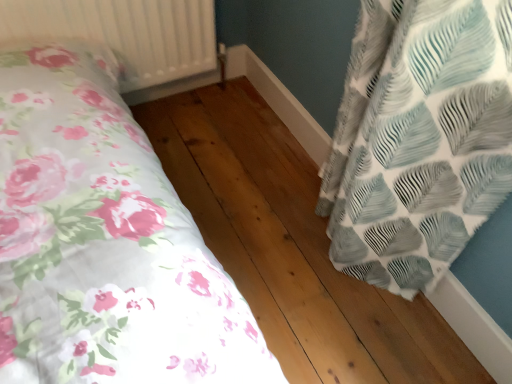
Question: Considering the relative sizes of natural wood flooring at center and white textured radiator at upper left in the image provided, is natural wood flooring at center wider than white textured radiator at upper left?

Choices:
 (A) yes
 (B) no

Answer: (B)

Question: From a real-world perspective, is natural wood flooring at center on white textured radiator at upper left?

Choices:
 (A) no
 (B) yes

Answer: (A)

Question: Is natural wood flooring at center oriented towards white textured radiator at upper left?

Choices:
 (A) no
 (B) yes

Answer: (A)

Question: Is natural wood flooring at center at the right side of white textured radiator at upper left?

Choices:
 (A) no
 (B) yes

Answer: (B)

Question: Is natural wood flooring at center not within white textured radiator at upper left?

Choices:
 (A) yes
 (B) no

Answer: (A)

Question: Is natural wood flooring at center positioned before white textured radiator at upper left?

Choices:
 (A) no
 (B) yes

Answer: (B)

Question: Considering the relative positions of white textured radiator at upper left and natural wood flooring at center in the image provided, is white textured radiator at upper left to the left of natural wood flooring at center from the viewer's perspective?

Choices:
 (A) yes
 (B) no

Answer: (A)

Question: Can natural wood flooring at center be found inside white textured radiator at upper left?

Choices:
 (A) yes
 (B) no

Answer: (B)

Question: Are white textured radiator at upper left and natural wood flooring at center far apart?

Choices:
 (A) no
 (B) yes

Answer: (A)

Question: Does white textured radiator at upper left appear on the right side of natural wood flooring at center?

Choices:
 (A) no
 (B) yes

Answer: (A)

Question: From a real-world perspective, is white textured radiator at upper left physically below natural wood flooring at center?

Choices:
 (A) yes
 (B) no

Answer: (B)

Question: Does white textured radiator at upper left have a greater width compared to natural wood flooring at center?

Choices:
 (A) yes
 (B) no

Answer: (A)

Question: Is white textured radiator at upper left wider or thinner than natural wood flooring at center?

Choices:
 (A) thin
 (B) wide

Answer: (B)